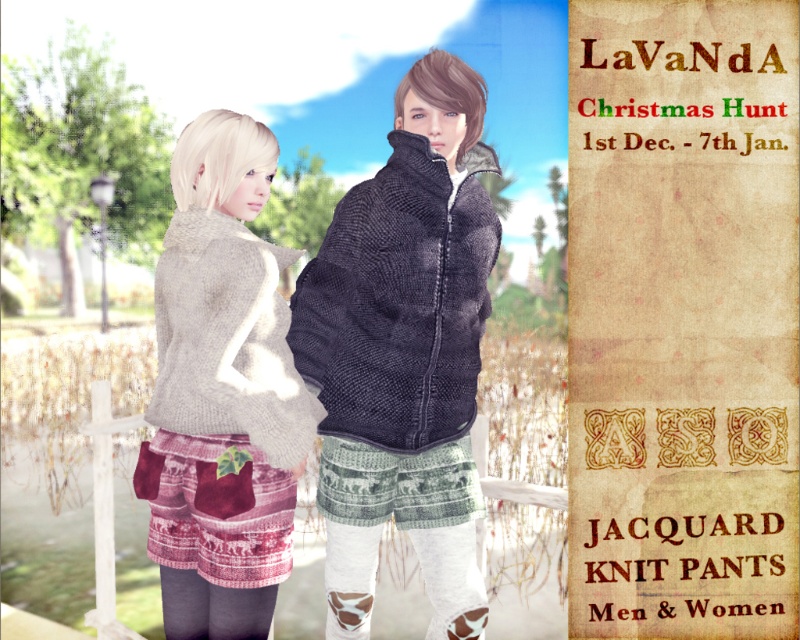
Question: Which object appears farthest from the camera in this image?

Choices:
 (A) knitted wool sweater at center
 (B) knitted gray sweater at center
 (C) jacquard knit pants at right
 (D) dark gray knitted jacket at center

Answer: (C)

Question: Can you confirm if knitted wool sweater at center is wider than dark gray knitted jacket at center?

Choices:
 (A) yes
 (B) no

Answer: (B)

Question: Which point is closer to the camera?

Choices:
 (A) knitted wool sweater at center
 (B) dark gray knitted jacket at center

Answer: (A)

Question: Does jacquard knit pants at right appear on the right side of dark gray knitted jacket at center?

Choices:
 (A) yes
 (B) no

Answer: (A)

Question: Among these points, which one is farthest from the camera?

Choices:
 (A) (218, 332)
 (B) (242, 269)

Answer: (B)

Question: Is the position of jacquard knit pants at right more distant than that of dark gray knitted jacket at center?

Choices:
 (A) no
 (B) yes

Answer: (B)